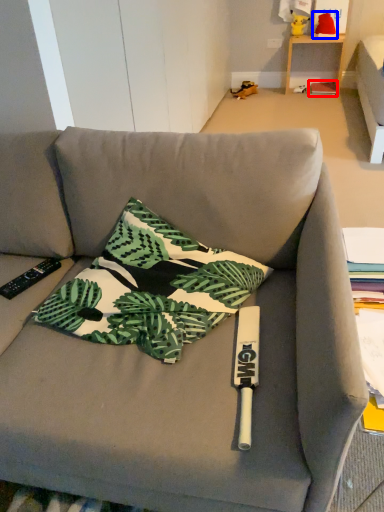
Question: Which object is closer to the camera taking this photo, paperback book (highlighted by a red box) or toy (highlighted by a blue box)?

Choices:
 (A) paperback book
 (B) toy

Answer: (B)